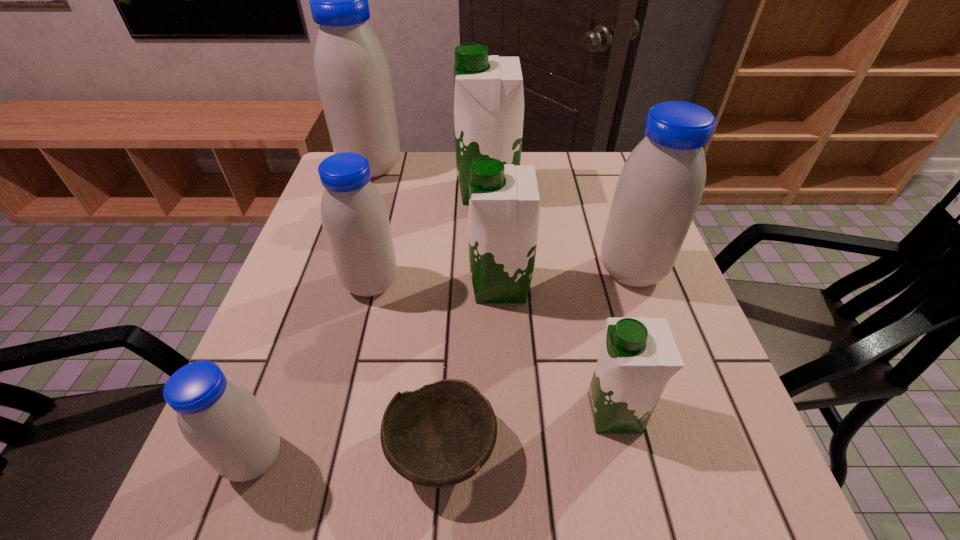
The image size is (960, 540). What are the coordinates of `vacant space at the left edge of the desktop` in the screenshot? It's located at (293, 350).

The image size is (960, 540). I want to click on vacant space at the far left corner, so click(x=385, y=180).

Find the location of `vacant area at the near left corner of the desktop`. vacant area at the near left corner of the desktop is located at coordinates (267, 521).

Where is `vacant area at the near right corner`? vacant area at the near right corner is located at coordinates (758, 505).

The image size is (960, 540). I want to click on free spot between the third biggest blue soya milk and the smallest blue soya milk, so click(x=313, y=370).

This screenshot has width=960, height=540. I want to click on free space that is in between the nearest blue soya milk and the second nearest green soya milk, so click(377, 372).

The width and height of the screenshot is (960, 540). Find the location of `free spot between the smallest blue soya milk and the second farthest green soya milk`. free spot between the smallest blue soya milk and the second farthest green soya milk is located at coordinates (377, 372).

Where is `vacant space that is in between the third biggest blue soya milk and the biggest green soya milk`? vacant space that is in between the third biggest blue soya milk and the biggest green soya milk is located at coordinates 429,238.

What are the coordinates of `vacant point located between the biggest green soya milk and the second smallest blue soya milk` in the screenshot? It's located at (429, 238).

Locate an element on the screen. free space between the rightmost green soya milk and the bowl is located at coordinates (528, 430).